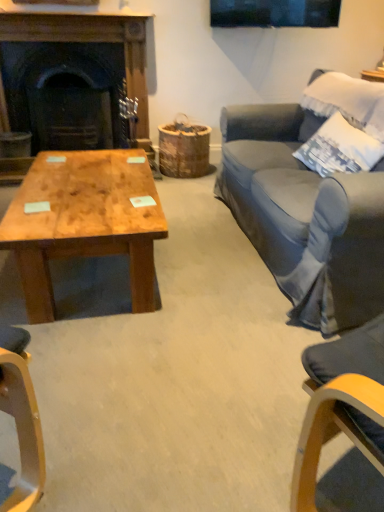
Where is `vacant region above dark wood fireplace at left (from a real-world perspective)`? This screenshot has height=512, width=384. vacant region above dark wood fireplace at left (from a real-world perspective) is located at coordinates (67, 20).